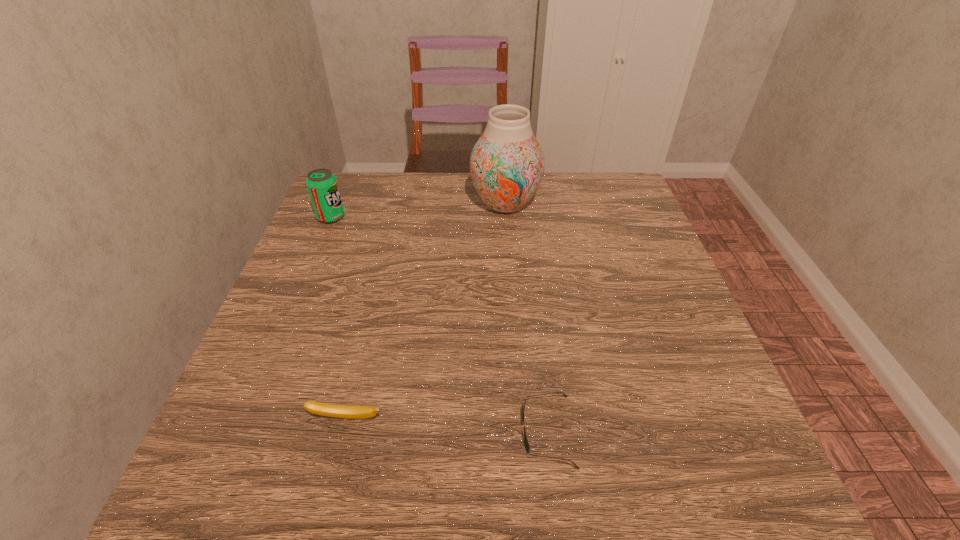
I want to click on the tallest object, so click(x=507, y=163).

This screenshot has width=960, height=540. Find the location of `the third shortest object`. the third shortest object is located at coordinates (322, 186).

Find the location of a particular element. The width and height of the screenshot is (960, 540). pop soda is located at coordinates (322, 186).

You are a GUI agent. You are given a task and a screenshot of the screen. Output one action in this format:
    pyautogui.click(x=<x>, y=<y>)
    Task: Click on the third object from right to left
    
    Given the screenshot: What is the action you would take?
    pyautogui.click(x=331, y=410)

This screenshot has width=960, height=540. What are the coordinates of `banana` in the screenshot? It's located at (331, 410).

This screenshot has height=540, width=960. In order to click on the shortest object in this screenshot , I will do `click(527, 447)`.

Where is `vacant area located 0.110m on the left of the vase`? vacant area located 0.110m on the left of the vase is located at coordinates (429, 204).

Where is `free point located on the front-facing side of the second tallest object`? The image size is (960, 540). free point located on the front-facing side of the second tallest object is located at coordinates (464, 217).

Image resolution: width=960 pixels, height=540 pixels. In order to click on vacant area situated at the stem of the banana in this screenshot , I will do `click(333, 475)`.

Locate an element on the screen. This screenshot has height=540, width=960. vacant space located on the lenses of the shortest object is located at coordinates (467, 431).